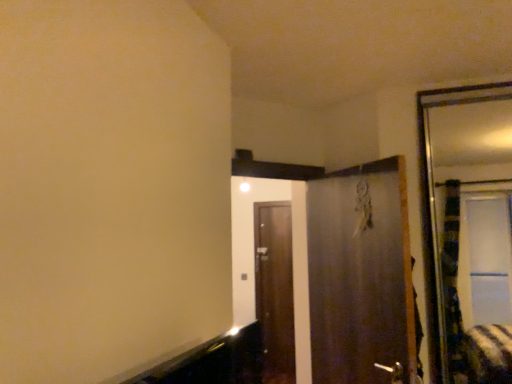
Describe the element at coordinates (392, 371) in the screenshot. I see `silver metallic door handle at lower center` at that location.

What do you see at coordinates (275, 289) in the screenshot?
I see `brown wooden door at center, the second door positioned from the front` at bounding box center [275, 289].

This screenshot has height=384, width=512. What do you see at coordinates (354, 268) in the screenshot? I see `metallic silver door at center, arranged as the second door when viewed from the back` at bounding box center [354, 268].

In order to click on silver metallic door handle at lower center in this screenshot , I will do [x=392, y=371].

Is silver metallic door handle at lower center situated inside metallic silver door at center, arranged as the second door when viewed from the back, or outside?

silver metallic door handle at lower center exists entirely within metallic silver door at center, arranged as the second door when viewed from the back.

Looking at the image, does silver metallic door handle at lower center seem bigger or smaller compared to metallic silver door at center, arranged as the second door when viewed from the back?

Considering their sizes, silver metallic door handle at lower center takes up less space than metallic silver door at center, arranged as the second door when viewed from the back.

Is silver metallic door handle at lower center not near metallic silver door at center, arranged as the first door when viewed from the front?

No, silver metallic door handle at lower center is in close proximity to metallic silver door at center, arranged as the first door when viewed from the front.

From the image's perspective, is silver metallic door handle at lower center over metallic silver door at center, arranged as the second door when viewed from the back?

No, from the image's perspective, silver metallic door handle at lower center is not over metallic silver door at center, arranged as the second door when viewed from the back.

Is silver metallic door handle at lower center behind brown wooden door at center, the second door positioned from the front?

No, it is in front of brown wooden door at center, the second door positioned from the front.

Identify the location of door handle that appears above the brown wooden door at center, the first door from the back (from the image's perspective). (392, 371).

Is silver metallic door handle at lower center located outside brown wooden door at center, the second door positioned from the front?

Absolutely, silver metallic door handle at lower center is external to brown wooden door at center, the second door positioned from the front.

In the image, is silver metallic door handle at lower center on the left side or the right side of brown wooden door at center, the second door positioned from the front?

From the image, it's evident that silver metallic door handle at lower center is to the right of brown wooden door at center, the second door positioned from the front.

From the image's perspective, is brown wooden door at center, the second door positioned from the front, above or below silver metallic door handle at lower center?

brown wooden door at center, the second door positioned from the front, is below silver metallic door handle at lower center.

Is brown wooden door at center, the first door from the back, facing away from silver metallic door handle at lower center?

No, brown wooden door at center, the first door from the back,'s orientation is not away from silver metallic door handle at lower center.

From the picture: Is brown wooden door at center, the first door from the back, taller or shorter than silver metallic door handle at lower center?

Considering their sizes, brown wooden door at center, the first door from the back, has more height than silver metallic door handle at lower center.

Between brown wooden door at center, the first door from the back, and silver metallic door handle at lower center, which one is positioned in front?

silver metallic door handle at lower center is closer to the camera.

Is brown wooden door at center, the second door positioned from the front, oriented away from metallic silver door at center, arranged as the second door when viewed from the back?

That's not correct — brown wooden door at center, the second door positioned from the front, is not looking away from metallic silver door at center, arranged as the second door when viewed from the back.

Is brown wooden door at center, the second door positioned from the front, shorter than metallic silver door at center, arranged as the second door when viewed from the back?

Incorrect, the height of brown wooden door at center, the second door positioned from the front, does not fall short of that of metallic silver door at center, arranged as the second door when viewed from the back.

Locate an element on the screen. This screenshot has width=512, height=384. door on the left of metallic silver door at center, arranged as the second door when viewed from the back is located at coordinates (275, 289).

Would you say brown wooden door at center, the first door from the back, is part of metallic silver door at center, arranged as the first door when viewed from the front,'s contents?

No, brown wooden door at center, the first door from the back, is not inside metallic silver door at center, arranged as the first door when viewed from the front.

Considering the relative sizes of metallic silver door at center, arranged as the second door when viewed from the back, and brown wooden door at center, the second door positioned from the front, in the image provided, is metallic silver door at center, arranged as the second door when viewed from the back, smaller than brown wooden door at center, the second door positioned from the front,?

Actually, metallic silver door at center, arranged as the second door when viewed from the back, might be larger than brown wooden door at center, the second door positioned from the front.

Where is `door above the brown wooden door at center, the second door positioned from the front (from a real-world perspective)`? This screenshot has height=384, width=512. door above the brown wooden door at center, the second door positioned from the front (from a real-world perspective) is located at coordinates (354, 268).

Which object is positioned more to the left, metallic silver door at center, arranged as the first door when viewed from the front, or brown wooden door at center, the first door from the back?

brown wooden door at center, the first door from the back, is more to the left.

From the image's perspective, is metallic silver door at center, arranged as the first door when viewed from the front, above or below silver metallic door handle at lower center?

Based on their image positions, metallic silver door at center, arranged as the first door when viewed from the front, is located above silver metallic door handle at lower center.

Can you confirm if metallic silver door at center, arranged as the second door when viewed from the back, is smaller than silver metallic door handle at lower center?

No.

From a real-world perspective, is metallic silver door at center, arranged as the second door when viewed from the back, beneath silver metallic door handle at lower center?

No, from a real-world perspective, metallic silver door at center, arranged as the second door when viewed from the back, is not under silver metallic door handle at lower center.

At what (x,y) coordinates should I click in order to perform the action: click on the 1st door behind the silver metallic door handle at lower center. Please return your answer as a coordinate pair (x, y). This screenshot has width=512, height=384. Looking at the image, I should click on (354, 268).

The width and height of the screenshot is (512, 384). In order to click on door handle in front of the metallic silver door at center, arranged as the second door when viewed from the back in this screenshot , I will do `click(392, 371)`.

Identify the location of the 2nd door counting from the left of the silver metallic door handle at lower center. (275, 289).

Based on their spatial positions, is brown wooden door at center, the second door positioned from the front, or silver metallic door handle at lower center further from metallic silver door at center, arranged as the second door when viewed from the back?

brown wooden door at center, the second door positioned from the front, is further to metallic silver door at center, arranged as the second door when viewed from the back.

Consider the image. Considering their positions, is metallic silver door at center, arranged as the second door when viewed from the back, positioned closer to silver metallic door handle at lower center than brown wooden door at center, the first door from the back?

metallic silver door at center, arranged as the second door when viewed from the back, lies closer to silver metallic door handle at lower center than the other object.

Which object lies further to the anchor point metallic silver door at center, arranged as the second door when viewed from the back, silver metallic door handle at lower center or brown wooden door at center, the second door positioned from the front?

brown wooden door at center, the second door positioned from the front, is further to metallic silver door at center, arranged as the second door when viewed from the back.

Considering their positions, is brown wooden door at center, the first door from the back, positioned closer to silver metallic door handle at lower center than metallic silver door at center, arranged as the second door when viewed from the back?

Based on the image, metallic silver door at center, arranged as the second door when viewed from the back, appears to be nearer to silver metallic door handle at lower center.

When comparing their distances from brown wooden door at center, the second door positioned from the front, does silver metallic door handle at lower center or metallic silver door at center, arranged as the second door when viewed from the back, seem further?

Based on the image, silver metallic door handle at lower center appears to be further to brown wooden door at center, the second door positioned from the front.

From the image, which object appears to be nearer to brown wooden door at center, the second door positioned from the front, metallic silver door at center, arranged as the first door when viewed from the front, or silver metallic door handle at lower center?

metallic silver door at center, arranged as the first door when viewed from the front, is closer to brown wooden door at center, the second door positioned from the front.

This screenshot has height=384, width=512. Find the location of `door positioned between silver metallic door handle at lower center and brown wooden door at center, the second door positioned from the front, from near to far`. door positioned between silver metallic door handle at lower center and brown wooden door at center, the second door positioned from the front, from near to far is located at coordinates (354, 268).